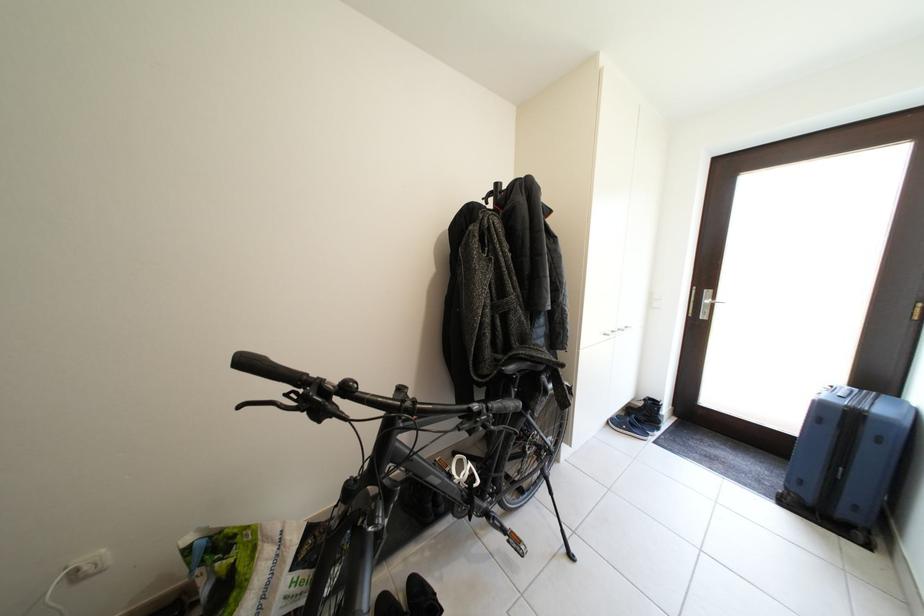
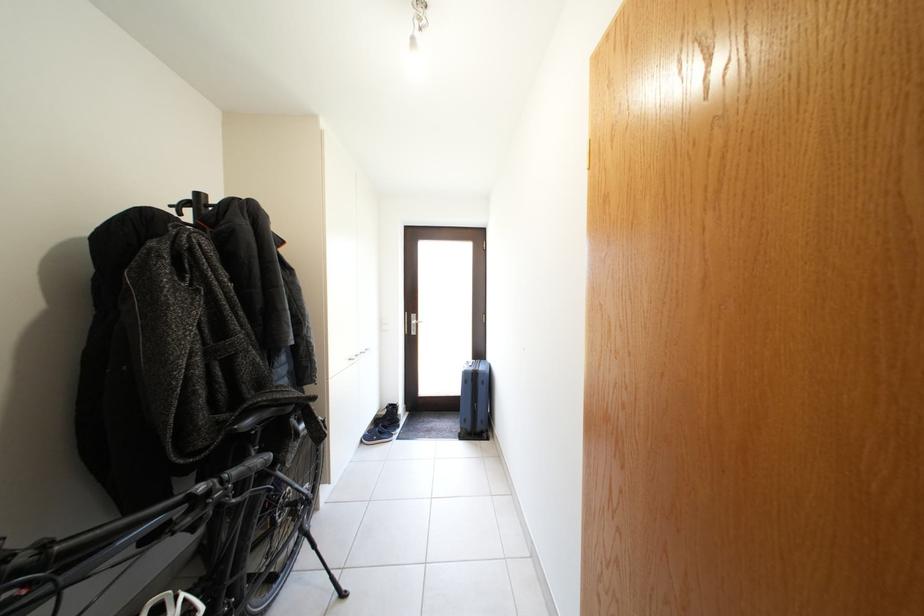
In the second image, find the point that corresponds to the point at 715,299 in the first image.

(421, 322)